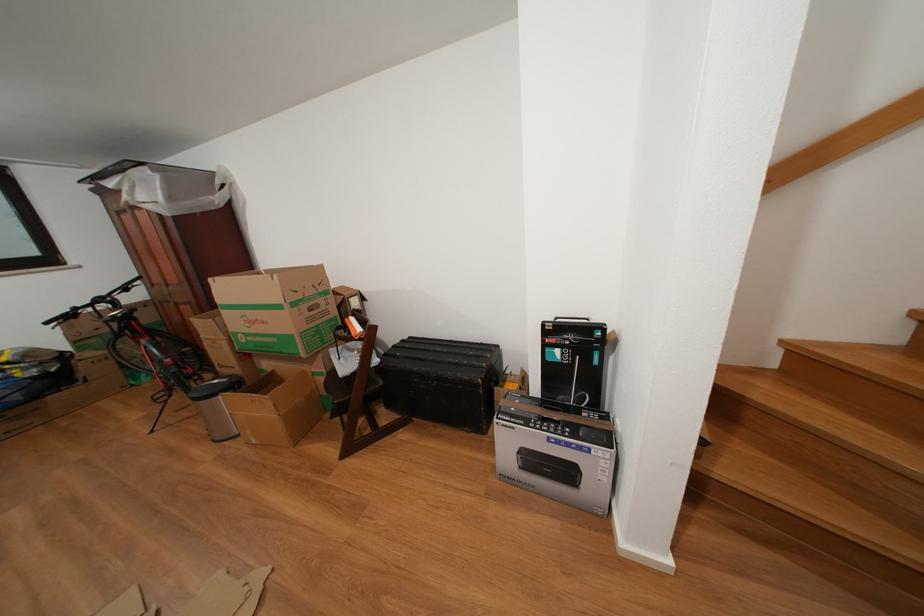
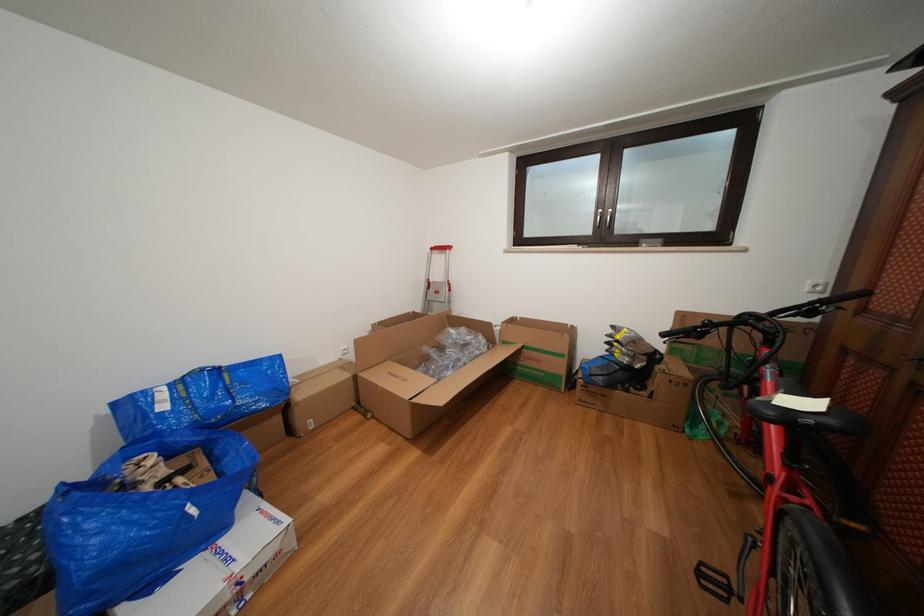
The point at (164, 406) is marked in the first image. Where is the corresponding point in the second image?

(708, 578)